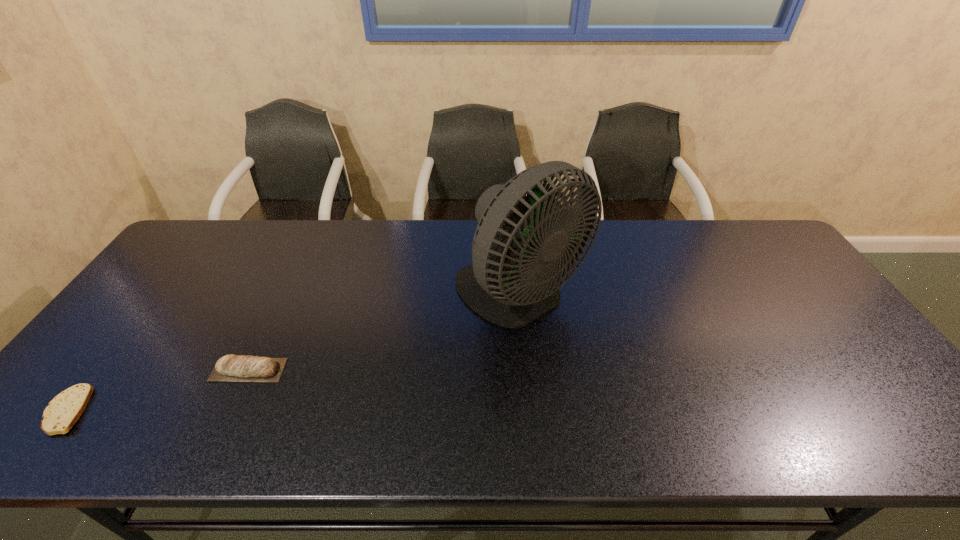
Identify the location of the rightmost object. Image resolution: width=960 pixels, height=540 pixels. (503, 286).

This screenshot has height=540, width=960. I want to click on fan, so click(503, 286).

Locate an element on the screen. This screenshot has height=540, width=960. the right pita bread is located at coordinates (230, 368).

I want to click on the second object from left to right, so click(x=230, y=368).

Identify the location of the left pita bread. (65, 409).

In order to click on the nearer pita bread in this screenshot , I will do (65, 409).

You are a GUI agent. You are given a task and a screenshot of the screen. Output one action in this format:
    pyautogui.click(x=<x>, y=<y>)
    Task: Click on the vacant space located in front of the farthest object to direct airflow
    The height and width of the screenshot is (540, 960).
    Given the screenshot: What is the action you would take?
    pyautogui.click(x=528, y=374)

Find the location of `free space located 0.240m on the back of the farther pita bread`. free space located 0.240m on the back of the farther pita bread is located at coordinates (285, 293).

This screenshot has height=540, width=960. I want to click on free space located on the right of the nearest object, so click(x=228, y=410).

The image size is (960, 540). Identify the location of object present at the far edge. (503, 286).